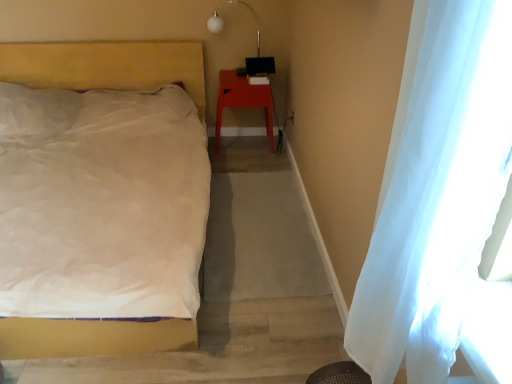
Question: From the image's perspective, is white matte bed at left under white sheer curtain at right?

Choices:
 (A) yes
 (B) no

Answer: (B)

Question: Is white matte bed at left next to white sheer curtain at right and touching it?

Choices:
 (A) yes
 (B) no

Answer: (B)

Question: Is the position of white matte bed at left more distant than that of white sheer curtain at right?

Choices:
 (A) no
 (B) yes

Answer: (B)

Question: Is white matte bed at left turned away from white sheer curtain at right?

Choices:
 (A) yes
 (B) no

Answer: (B)

Question: Considering the relative sizes of white matte bed at left and white sheer curtain at right in the image provided, is white matte bed at left thinner than white sheer curtain at right?

Choices:
 (A) no
 (B) yes

Answer: (A)

Question: Is there a large distance between white matte bed at left and white sheer curtain at right?

Choices:
 (A) yes
 (B) no

Answer: (A)

Question: From the image's perspective, does white glass lamp at upper center appear higher than white matte bed at left?

Choices:
 (A) no
 (B) yes

Answer: (B)

Question: Is white glass lamp at upper center to the left of white matte bed at left from the viewer's perspective?

Choices:
 (A) no
 (B) yes

Answer: (A)

Question: Could you tell me if white glass lamp at upper center is turned towards white matte bed at left?

Choices:
 (A) yes
 (B) no

Answer: (B)

Question: Can you confirm if white glass lamp at upper center is bigger than white matte bed at left?

Choices:
 (A) yes
 (B) no

Answer: (B)

Question: From a real-world perspective, is white glass lamp at upper center on top of white matte bed at left?

Choices:
 (A) no
 (B) yes

Answer: (B)

Question: Does white glass lamp at upper center have a greater width compared to white matte bed at left?

Choices:
 (A) yes
 (B) no

Answer: (B)

Question: Considering the relative positions of white matte bed at left and white glass lamp at upper center in the image provided, is white matte bed at left in front of white glass lamp at upper center?

Choices:
 (A) yes
 (B) no

Answer: (A)